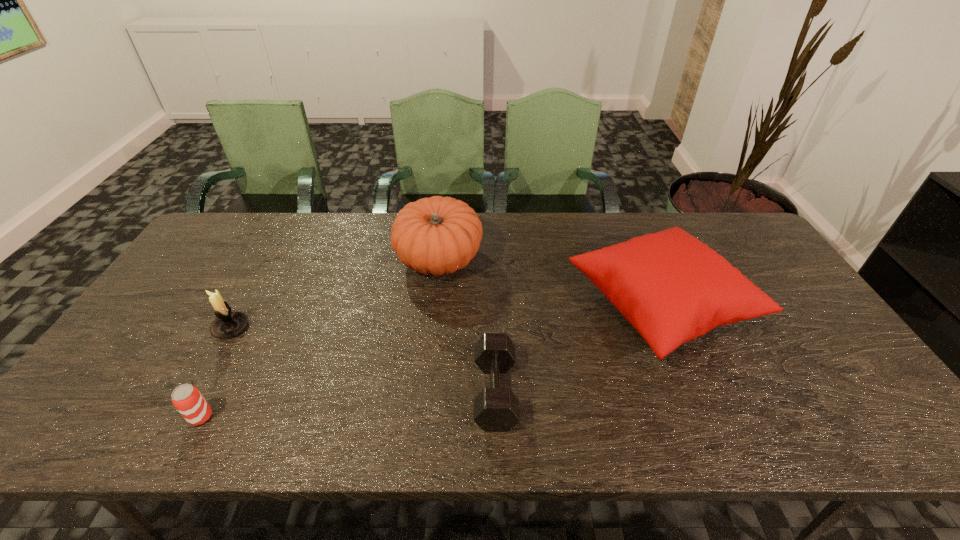
You are a GUI agent. You are given a task and a screenshot of the screen. Output one action in this format:
    pyautogui.click(x=<x>, y=<y>)
    Task: Click on the empty space between the cushion and the beer can
    This screenshot has height=540, width=960.
    Given the screenshot: What is the action you would take?
    pyautogui.click(x=431, y=361)

You are a GUI agent. You are given a task and a screenshot of the screen. Output one action in this format:
    pyautogui.click(x=<x>, y=<y>)
    Task: Click on the empty location between the dumbbell and the third shortest object
    Image resolution: width=960 pixels, height=540 pixels.
    Given the screenshot: What is the action you would take?
    pyautogui.click(x=363, y=360)

You are a GUI agent. You are given a task and a screenshot of the screen. Output one action in this format:
    pyautogui.click(x=<x>, y=<y>)
    Task: Click on the vacant space in between the beer can and the dumbbell
    The height and width of the screenshot is (540, 960).
    Given the screenshot: What is the action you would take?
    pyautogui.click(x=348, y=404)

Locate an element on the screen. Image resolution: width=960 pixels, height=540 pixels. free spot between the beer can and the pumpkin is located at coordinates (320, 338).

Image resolution: width=960 pixels, height=540 pixels. What are the coordinates of `free space that is in between the candle holder and the pumpkin` in the screenshot? It's located at (335, 294).

What are the coordinates of `free space between the pumpkin and the rightmost object` in the screenshot? It's located at (550, 282).

The image size is (960, 540). I want to click on empty space between the beer can and the dumbbell, so click(x=348, y=404).

You are a GUI agent. You are given a task and a screenshot of the screen. Output one action in this format:
    pyautogui.click(x=<x>, y=<y>)
    Task: Click on the vacant area between the pumpkin and the dumbbell
    This screenshot has width=960, height=540.
    Given the screenshot: What is the action you would take?
    pyautogui.click(x=468, y=326)

I want to click on vacant area between the cushion and the third shortest object, so [x=445, y=316].

You are a GUI agent. You are given a task and a screenshot of the screen. Output one action in this format:
    pyautogui.click(x=<x>, y=<y>)
    Task: Click on the free space between the pumpkin and the dumbbell
    The width and height of the screenshot is (960, 540).
    Given the screenshot: What is the action you would take?
    pyautogui.click(x=468, y=326)